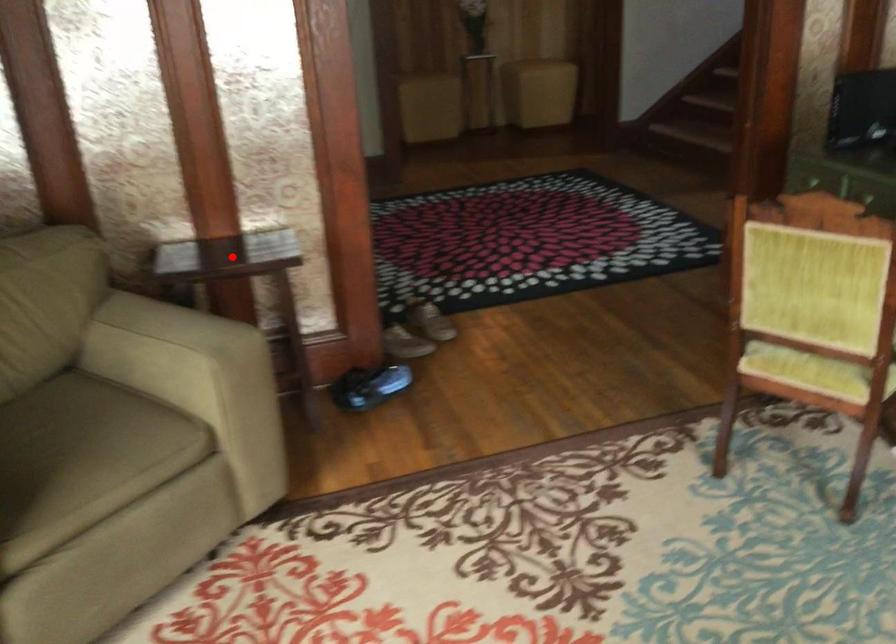
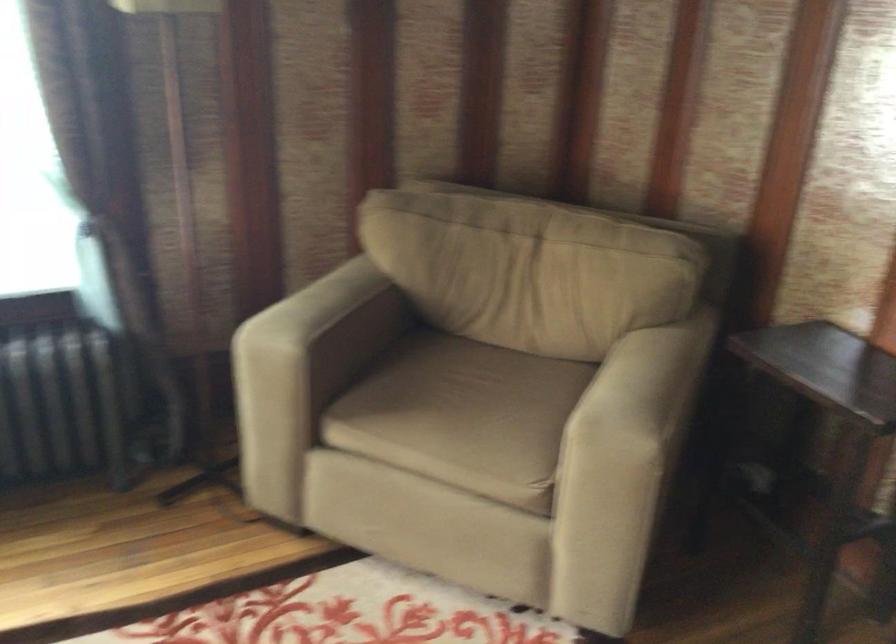
Where in the second image is the point corresponding to the highlighted location from the first image?

(826, 368)